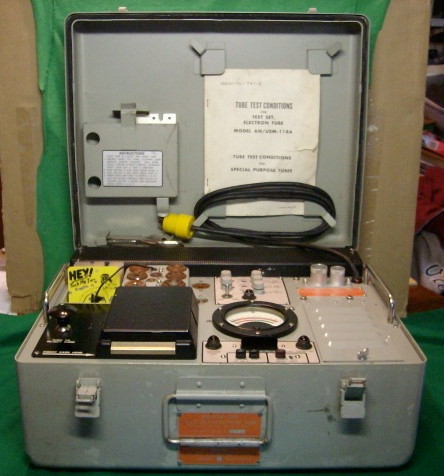
At what (x,y) coordinates should I click in order to perform the action: click on sticker. Please return your answer as a coordinate pair (x, y). This screenshot has width=444, height=476. Looking at the image, I should click on (131, 167).